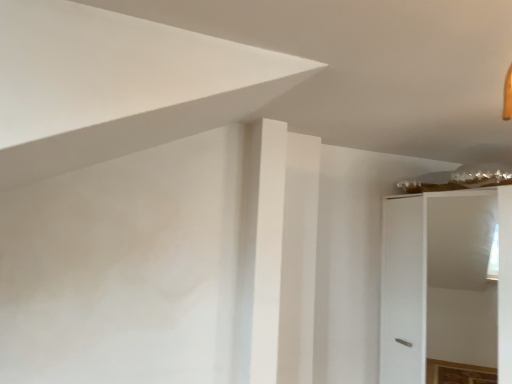
At what (x,y) coordinates should I click in order to perform the action: click on white matte cabinet at right. Please return your answer as a coordinate pair (x, y). This screenshot has height=384, width=512. Looking at the image, I should click on 445,282.

What do you see at coordinates (445, 282) in the screenshot? The width and height of the screenshot is (512, 384). I see `white matte cabinet at right` at bounding box center [445, 282].

This screenshot has height=384, width=512. Find the location of `white matte cabinet at right`. white matte cabinet at right is located at coordinates (445, 282).